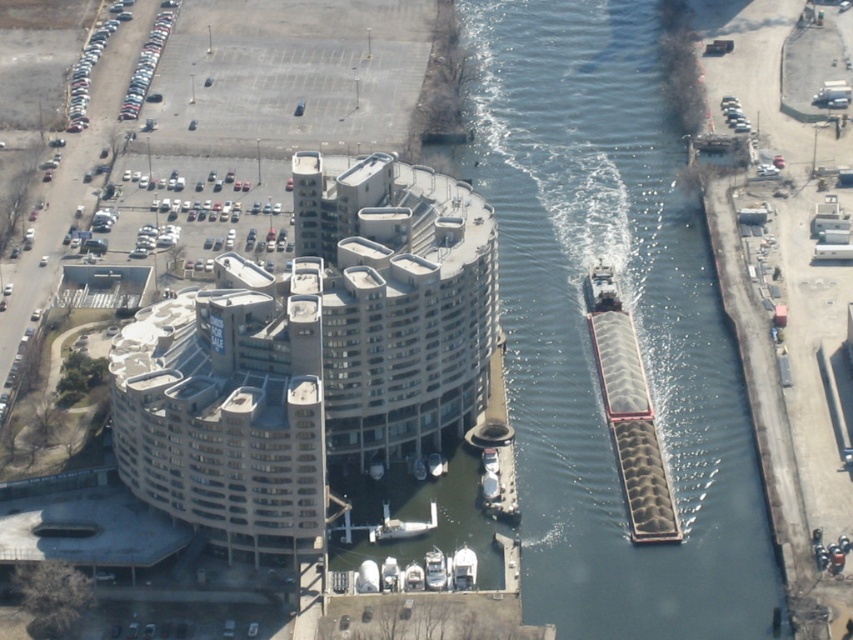
Which of these two, metallic gray barge at center-right or white matte boat at lower center, stands shorter?

With less height is white matte boat at lower center.

At what (x,y) coordinates should I click in order to perform the action: click on metallic gray barge at center-right. Please return your answer as a coordinate pair (x, y). Looking at the image, I should click on (601, 289).

Who is higher up, smooth concrete waterway at center or metallic gray barge at center-right?

smooth concrete waterway at center is higher up.

Can you confirm if smooth concrete waterway at center is shorter than metallic gray barge at center-right?

No.

Locate an element on the screen. The height and width of the screenshot is (640, 853). smooth concrete waterway at center is located at coordinates (x=585, y=324).

At what (x,y) coordinates should I click in order to perform the action: click on smooth concrete waterway at center. Please return your answer as a coordinate pair (x, y). Looking at the image, I should click on (585, 324).

Is point (550, 76) behind point (422, 529)?

Yes.

This screenshot has width=853, height=640. I want to click on smooth concrete waterway at center, so click(585, 324).

Which is behind, point (608, 113) or point (410, 522)?

Point (608, 113)

At what (x,y) coordinates should I click in order to perform the action: click on smooth concrete waterway at center. Please return your answer as a coordinate pair (x, y). This screenshot has height=640, width=853. Looking at the image, I should click on (585, 324).